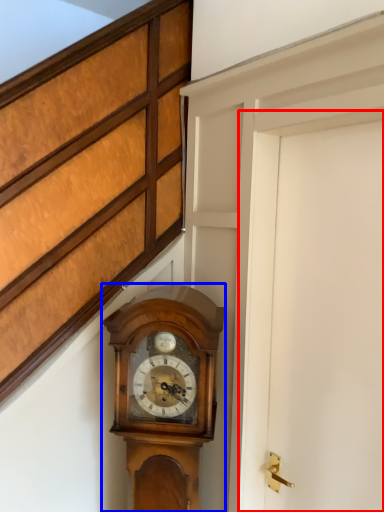
Question: Which object is closer to the camera taking this photo, door (highlighted by a red box) or wall clock (highlighted by a blue box)?

Choices:
 (A) door
 (B) wall clock

Answer: (A)